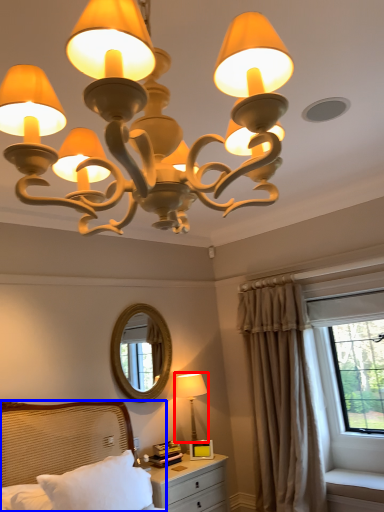
Question: Which object is further to the camera taking this photo, lamp (highlighted by a red box) or bed (highlighted by a blue box)?

Choices:
 (A) lamp
 (B) bed

Answer: (A)